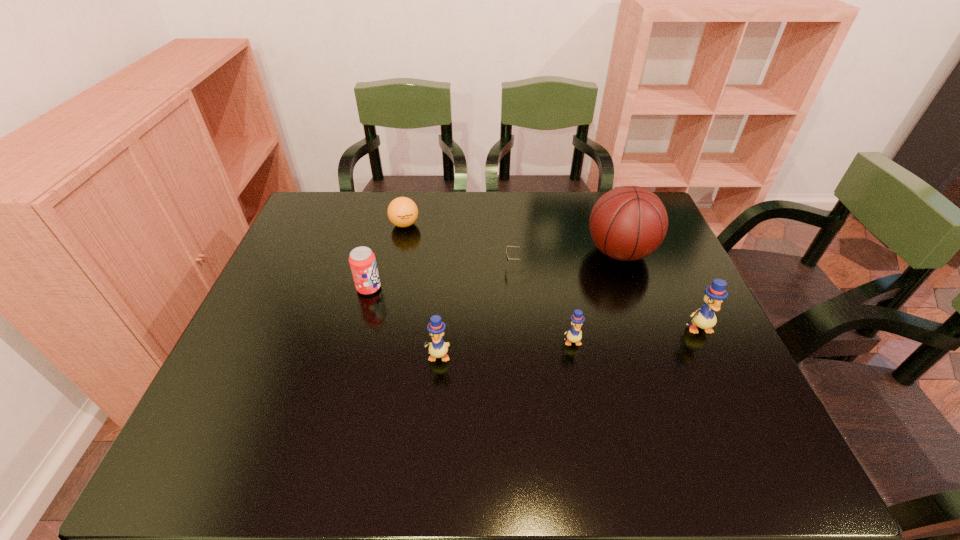
This screenshot has width=960, height=540. I want to click on the third object from left to right, so click(x=438, y=348).

Identify the location of the second tallest duckling. (438, 348).

The width and height of the screenshot is (960, 540). I want to click on the fifth object from left to right, so click(574, 335).

Identify the location of the second duckling from right to left. Image resolution: width=960 pixels, height=540 pixels. (574, 335).

The width and height of the screenshot is (960, 540). Find the location of `the sixth shortest object`. the sixth shortest object is located at coordinates (704, 318).

This screenshot has width=960, height=540. In order to click on the rightmost duckling in this screenshot , I will do `click(704, 318)`.

Identify the location of basketball. This screenshot has width=960, height=540. (628, 223).

The image size is (960, 540). What are the coordinates of `sunglasses` in the screenshot? It's located at (507, 246).

Where is `the shortest object`? the shortest object is located at coordinates (507, 246).

Find the location of a particular element. The image size is (960, 540). ping-pong ball is located at coordinates (402, 211).